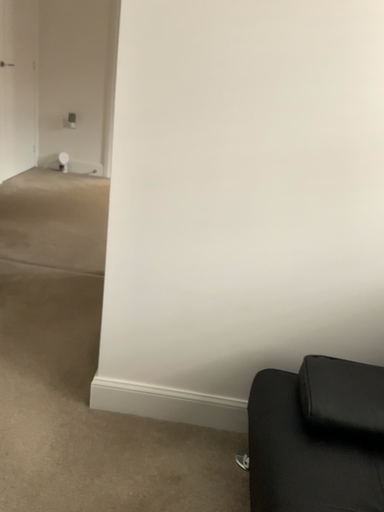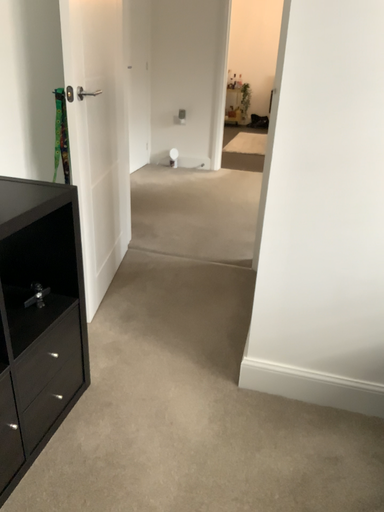
Question: How did the camera likely rotate when shooting the video?

Choices:
 (A) rotated right
 (B) rotated left

Answer: (B)